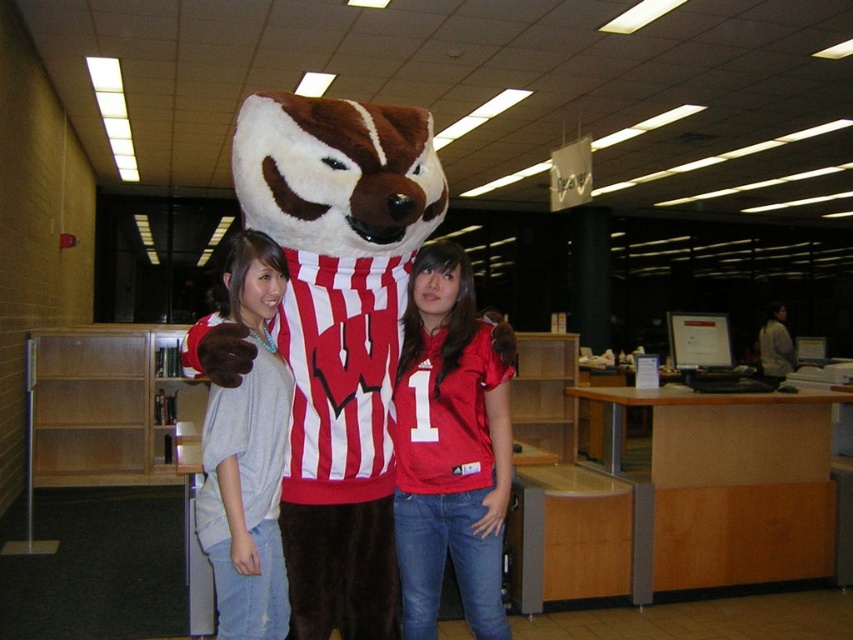
In the scene shown: You are a photographer setting up a photo shoot in a library. You have two main subjects to focus on, the brown plush mascot at center and the matte red jersey at center. Which subject should you adjust your camera focus on first if you want to capture the one that is closer to the camera?

The brown plush mascot at center is positioned over matte red jersey at center, so it is closer to the camera. Adjust focus on the brown plush mascot at center first.

You are a photographer trying to capture a group photo of the people in the scene. You want to ensure that both the brown plush mascot at center and the matte red jersey at center are visible in the frame. Based on their positions, which object should you position closer to the left side of the camera frame?

The brown plush mascot at center should be positioned closer to the left side of the camera frame since it is located to the left of the matte red jersey at center in the scene.